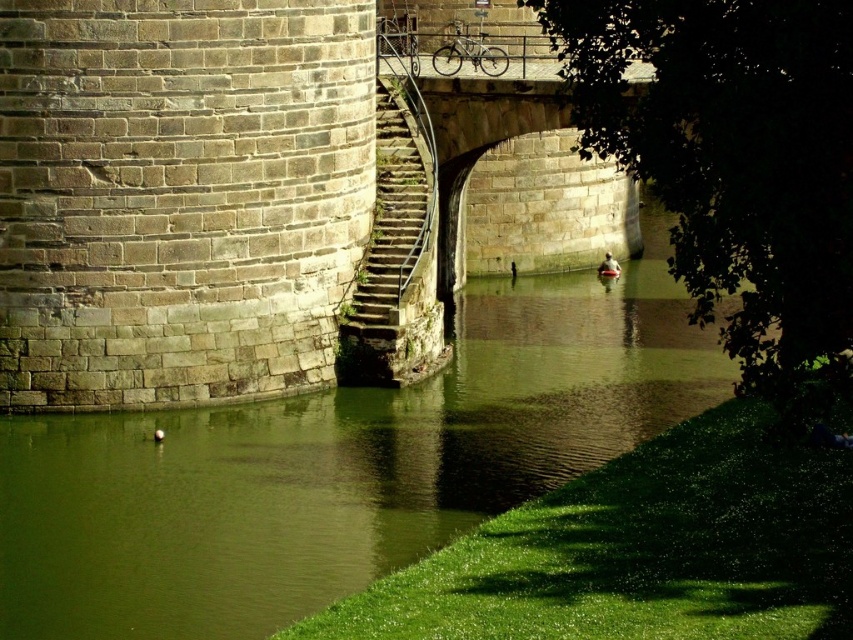
Does green stone river at center appear over stone textured stairs at center?

No.

Which is more to the left, green stone river at center or stone textured stairs at center?

stone textured stairs at center is more to the left.

Which is in front, point (96, 497) or point (409, 204)?

Point (96, 497)

Where is `green stone river at center`? The width and height of the screenshot is (853, 640). green stone river at center is located at coordinates (339, 465).